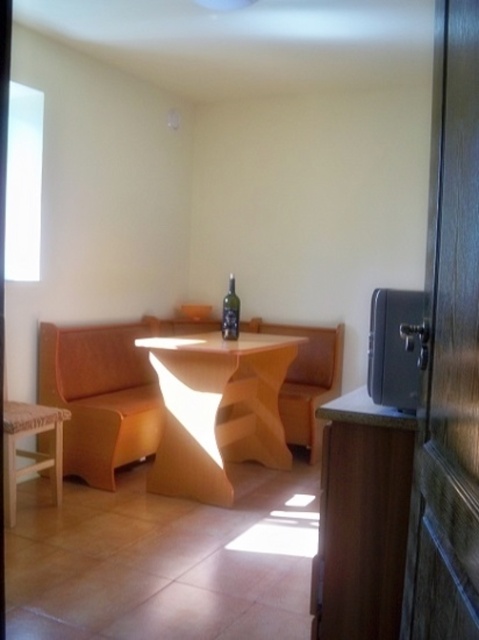
Can you confirm if matte orange table at center is positioned below wooden stool at lower left?

No, matte orange table at center is not below wooden stool at lower left.

Between point (231, 449) and point (10, 417), which one is positioned behind?

Point (231, 449)

Find the location of a particular element. The image size is (479, 640). matte orange table at center is located at coordinates (216, 410).

I want to click on matte orange table at center, so click(x=216, y=410).

How much distance is there between orange fabric armchair at left and green glass bottle at center?

orange fabric armchair at left is 37.22 inches away from green glass bottle at center.

Is point (144, 413) positioned in front of point (236, 307)?

No, it is behind (236, 307).

What do you see at coordinates (100, 396) in the screenshot? Image resolution: width=479 pixels, height=640 pixels. I see `orange fabric armchair at left` at bounding box center [100, 396].

Image resolution: width=479 pixels, height=640 pixels. What are the coordinates of `orange fabric armchair at left` in the screenshot? It's located at (100, 396).

Who is more forward, (310, 394) or (228, 289)?

Point (310, 394) is more forward.

Is wooden armchair at center further to camera compared to green glass bottle at center?

That is True.

You are a GUI agent. You are given a task and a screenshot of the screen. Output one action in this format:
    pyautogui.click(x=<x>, y=<y>)
    Task: Click on the wooden armchair at center
    The height and width of the screenshot is (640, 479).
    Given the screenshot: What is the action you would take?
    pyautogui.click(x=307, y=380)